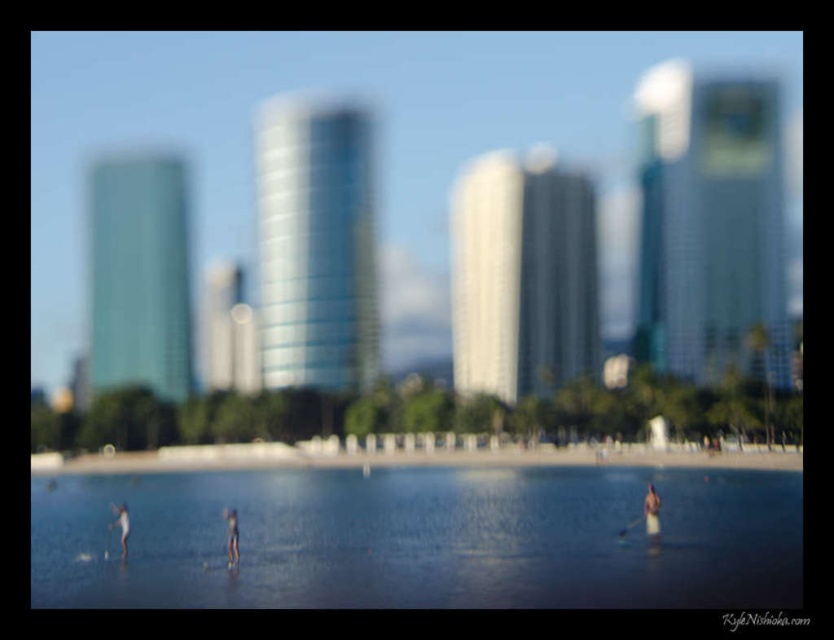
Is clear water at center behind smooth sand at lower center?

No, clear water at center is in front of smooth sand at lower center.

Can you confirm if clear water at center is taller than smooth sand at lower center?

Yes.

The width and height of the screenshot is (834, 640). I want to click on clear water at center, so click(420, 538).